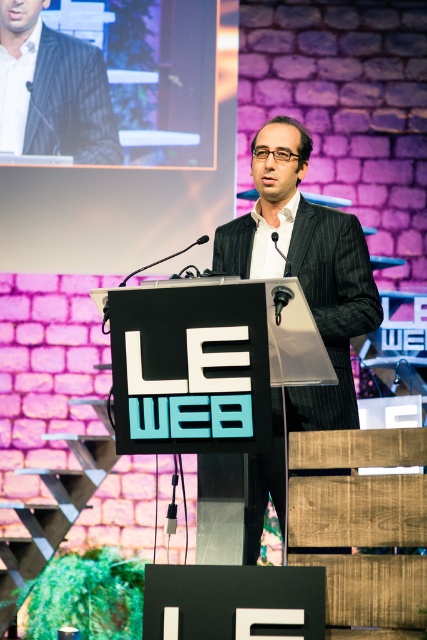
Is dark gray pinstripe suit at center positioned at the back of matte black suit at upper left?

No.

Who is shorter, dark gray pinstripe suit at center or matte black suit at upper left?

matte black suit at upper left is shorter.

Between point (278, 192) and point (85, 42), which one is positioned in front?

Point (278, 192) is in front.

Locate an element on the screen. Image resolution: width=427 pixels, height=640 pixels. dark gray pinstripe suit at center is located at coordinates (304, 266).